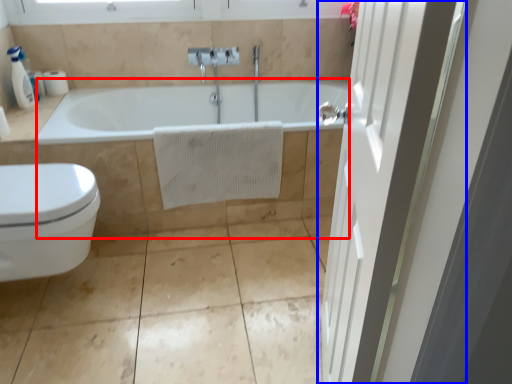
Question: Which object appears closest to the camera in this image, bath (highlighted by a red box) or door (highlighted by a blue box)?

Choices:
 (A) bath
 (B) door

Answer: (B)